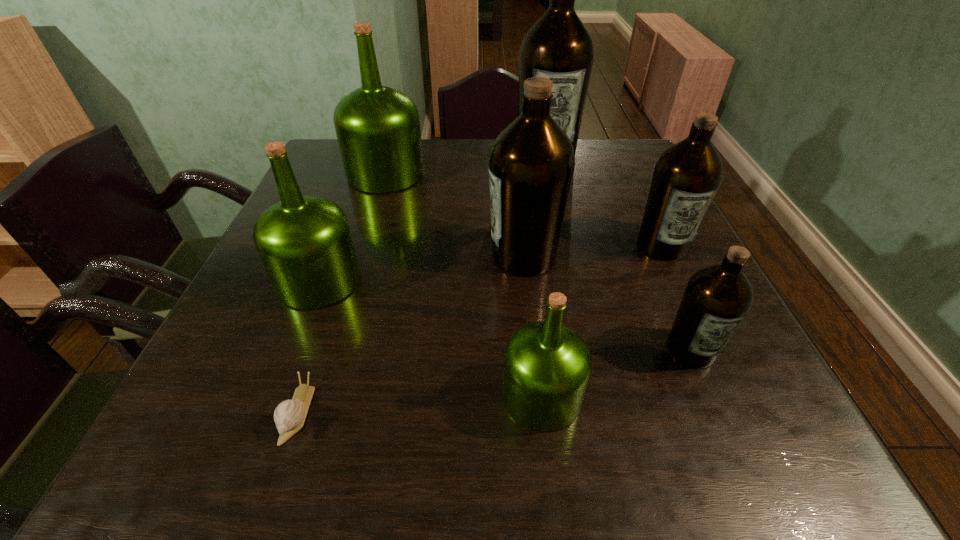
Where is `vacant space that's between the nearest green olive oil and the third biggest brown olive oil`? Image resolution: width=960 pixels, height=540 pixels. vacant space that's between the nearest green olive oil and the third biggest brown olive oil is located at coordinates (602, 321).

The width and height of the screenshot is (960, 540). I want to click on empty location between the biggest green olive oil and the second smallest green olive oil, so click(x=352, y=227).

Where is `vacant space in between the farthest green olive oil and the second biggest brown olive oil`? The height and width of the screenshot is (540, 960). vacant space in between the farthest green olive oil and the second biggest brown olive oil is located at coordinates (455, 215).

Where is `vacant space in between the second smallest brown olive oil and the escargot`? This screenshot has width=960, height=540. vacant space in between the second smallest brown olive oil and the escargot is located at coordinates (480, 329).

I want to click on unoccupied area between the biggest green olive oil and the nearest green olive oil, so click(464, 285).

The image size is (960, 540). I want to click on vacant space that is in between the second biggest green olive oil and the shortest object, so click(x=308, y=347).

Choose which object is the third nearest neighbor to the smallest brown olive oil. Please provide its 2D coordinates. Your answer should be formatted as a tuple, i.e. [(x, y)], where the tuple contains the x and y coordinates of a point satisfying the conditions above.

[(531, 164)]

Find the location of a particular element. object that is the second nearest to the second farthest green olive oil is located at coordinates (378, 130).

Identify which olive oil is located as the sixth nearest to the second biggest brown olive oil. Please provide its 2D coordinates. Your answer should be formatted as a tuple, i.e. [(x, y)], where the tuple contains the x and y coordinates of a point satisfying the conditions above.

[(558, 46)]

At what (x,y) coordinates should I click in order to perform the action: click on olive oil that is the third closest to the farthest brown olive oil. Please return your answer as a coordinate pair (x, y). The width and height of the screenshot is (960, 540). Looking at the image, I should click on (531, 164).